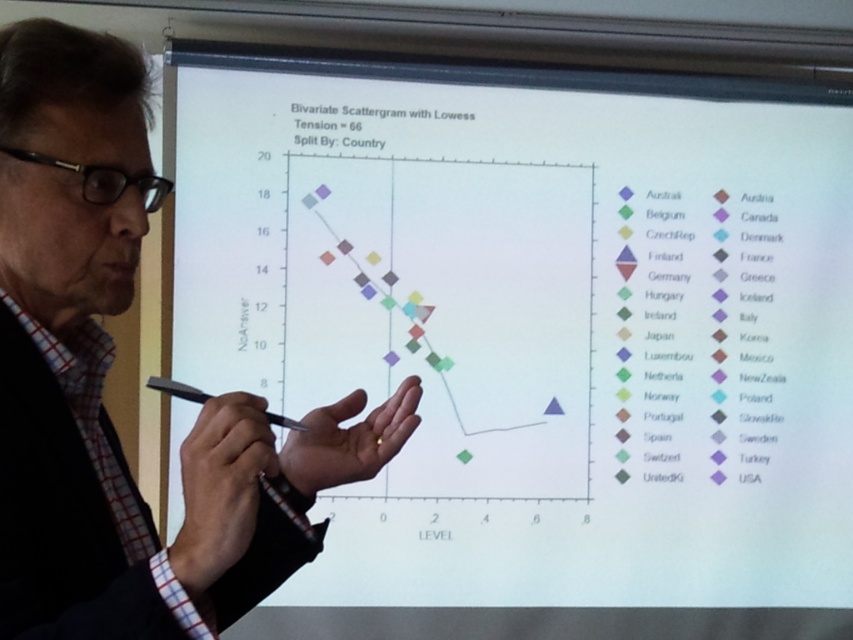
You are sitting in the audience of the presentation and want to point out the point at the center of the slide. Is the point at the center of the slide the point labeled as point (379, 392)?

The point labeled as point (379, 392) is 9.11 feet away from the viewer, so it is not at the center of the slide.

You are an attendee at this presentation. You notice two white items in the scene. The first is the white paper at upper center, and the second is the white shirt at left. Which of these white items is taller?

The white paper at upper center is much taller than the white shirt at left.

You are a stagehand who needs to adjust the lighting for the presenter. The presenter is standing near the white shirt at left, and you need to ensure the spotlight reaches both the presenter and the white paper at upper center. Given that the spotlight has a maximum range of 1.5 meters, will it be able to cover both areas?

The distance between the white paper at upper center and the white shirt at left is 1.54 meters. Since the spotlight can only reach up to 1.5 meters, it will not be able to cover both areas simultaneously.